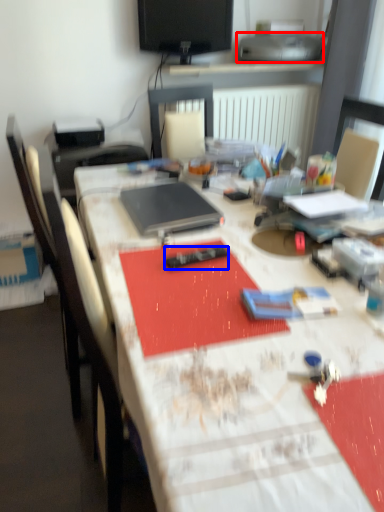
Question: Which object appears farthest to the camera in this image, printer (highlighted by a red box) or remote control (highlighted by a blue box)?

Choices:
 (A) printer
 (B) remote control

Answer: (A)